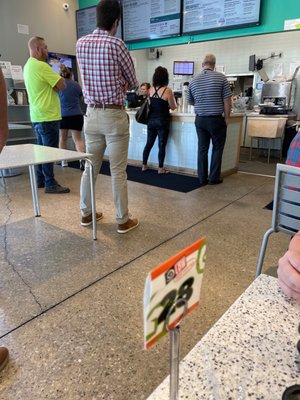
Find the location of a particular element. The height and width of the screenshot is (400, 300). table card is located at coordinates (176, 286).